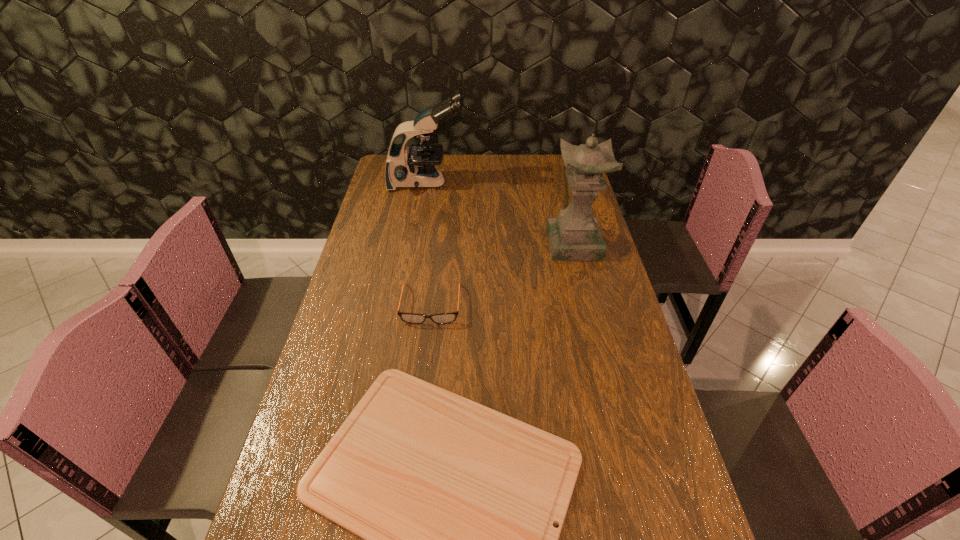
Locate an element on the screen. The width and height of the screenshot is (960, 540). empty space between the third nearest object and the spectacles is located at coordinates (503, 274).

You are a GUI agent. You are given a task and a screenshot of the screen. Output one action in this format:
    pyautogui.click(x=<x>, y=<y>)
    Task: Click on the vacant space in between the farthest object and the third farthest object
    
    Given the screenshot: What is the action you would take?
    pyautogui.click(x=429, y=244)

This screenshot has width=960, height=540. In order to click on object that is the second nearest to the second nearest object in this screenshot , I will do `click(575, 234)`.

At what (x,y) coordinates should I click in order to perform the action: click on object that can be found as the second closest to the shortest object. Please return your answer as a coordinate pair (x, y). The image size is (960, 540). Looking at the image, I should click on (575, 234).